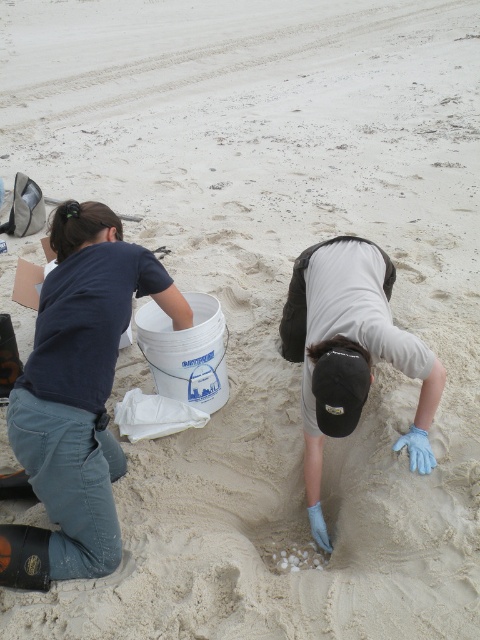
Question: Which object is closer to the camera taking this photo?

Choices:
 (A) dark blue fabric squat at left
 (B) blue latex gloves at lower center

Answer: (A)

Question: Is dark blue fabric squat at left thinner than blue latex gloves at lower center?

Choices:
 (A) no
 (B) yes

Answer: (A)

Question: Does dark blue fabric squat at left appear on the right side of blue latex gloves at lower center?

Choices:
 (A) no
 (B) yes

Answer: (A)

Question: Which object appears closest to the camera in this image?

Choices:
 (A) dark blue fabric squat at left
 (B) blue latex gloves at lower center

Answer: (A)

Question: Is dark blue fabric squat at left positioned before blue latex gloves at lower center?

Choices:
 (A) no
 (B) yes

Answer: (B)